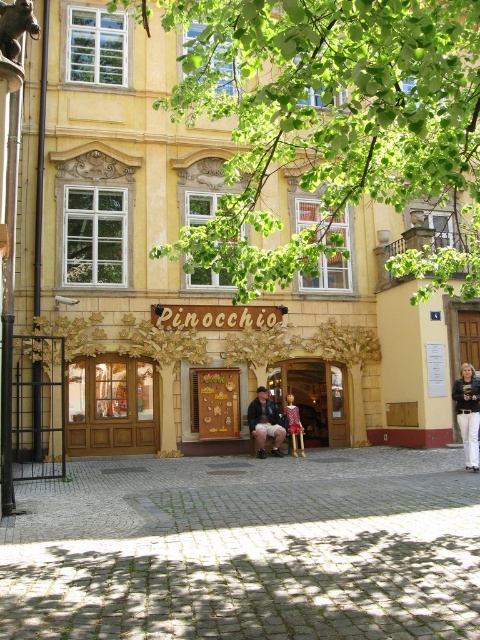
Is point (391, 188) positioned behind point (7, 8)?

Yes, it is.

Which is more to the left, green leafy tree at upper center or bronze statue at upper left?

Positioned to the left is bronze statue at upper left.

Does point (312, 188) come farther from viewer compared to point (7, 45)?

No, (312, 188) is closer to viewer.

Image resolution: width=480 pixels, height=640 pixels. I want to click on green leafy tree at upper center, so click(332, 122).

Can you confirm if white pants at lower right is bigger than matte pink dress at center?

No.

Based on the photo, who is higher up, white pants at lower right or matte pink dress at center?

white pants at lower right

Where is `white pants at lower right`? The width and height of the screenshot is (480, 640). white pants at lower right is located at coordinates (468, 412).

Can you confirm if white pants at lower right is positioned below bronze statue at upper left?

Correct, white pants at lower right is located below bronze statue at upper left.

Where is `white pants at lower right`? This screenshot has height=640, width=480. white pants at lower right is located at coordinates (468, 412).